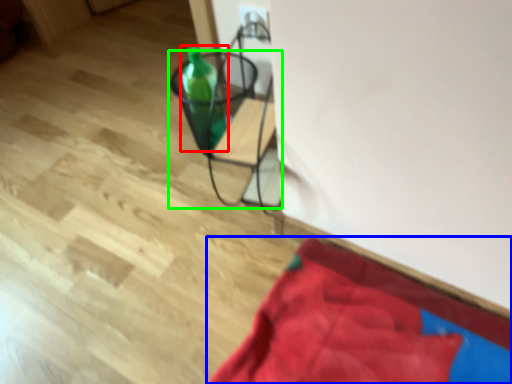
Question: Which object is the farthest from bottle (highlighted by a red box)? Choose among these: blanket (highlighted by a blue box) or furniture (highlighted by a green box).

Choices:
 (A) blanket
 (B) furniture

Answer: (A)